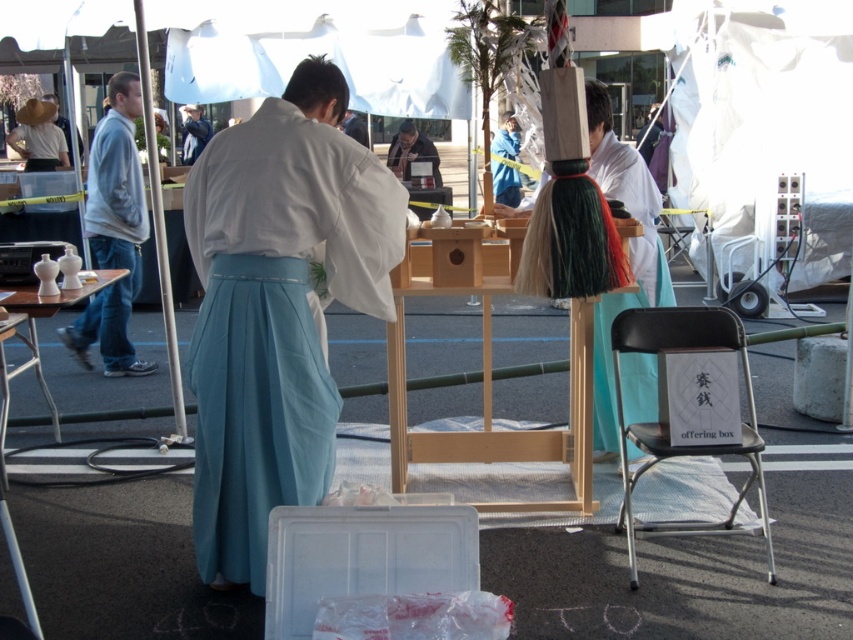
You are a photographer positioned at the back of the scene. You need to capture a photo where both the white silk kimono at center and the light blue silk robe at center are visible. Based on their positions, which one should you adjust your camera angle to focus on first to ensure both are in frame?

The white silk kimono at center is to the right of the light blue silk robe at center. To ensure both are in frame, you should first focus on the light blue silk robe at center, then adjust your angle to include the white silk kimono at center to its right.